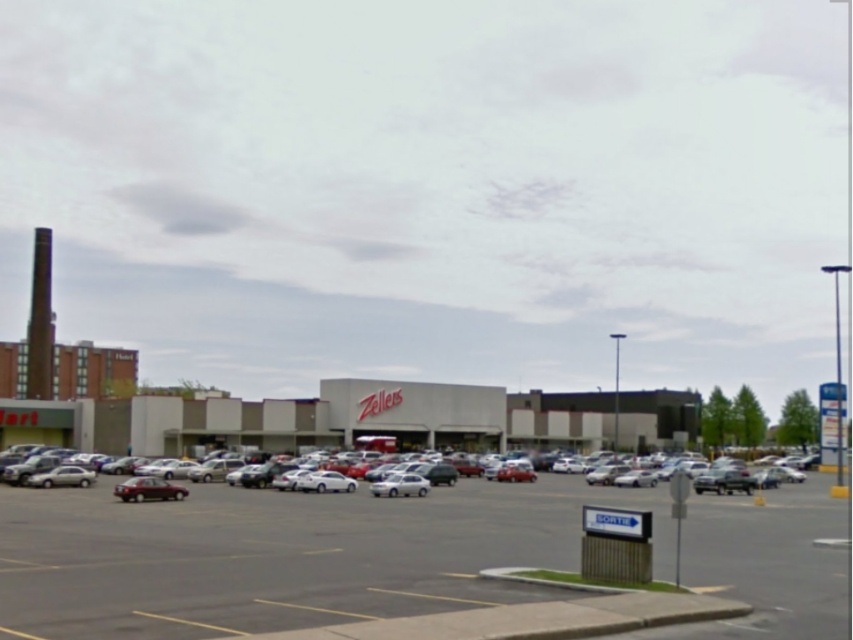
You are a parking attendant and need to guide a customer to their car. They mention they have a shiny silver sedan at center and a white glossy sedan at center. Which one is on the left side?

The white glossy sedan at center is on the left side because the shiny silver sedan at center is to the right of it.

You are a delivery driver who needs to park your truck between the metallic silver cars at center and the shiny silver sedan at center in the parking lot. The truck requires a space of 80 feet to park safely. Is there enough space between them?

The distance between the metallic silver cars at center and the shiny silver sedan at center is 77.63 feet, which is less than the required 80 feet. Therefore, there is not enough space to park the truck safely between them.